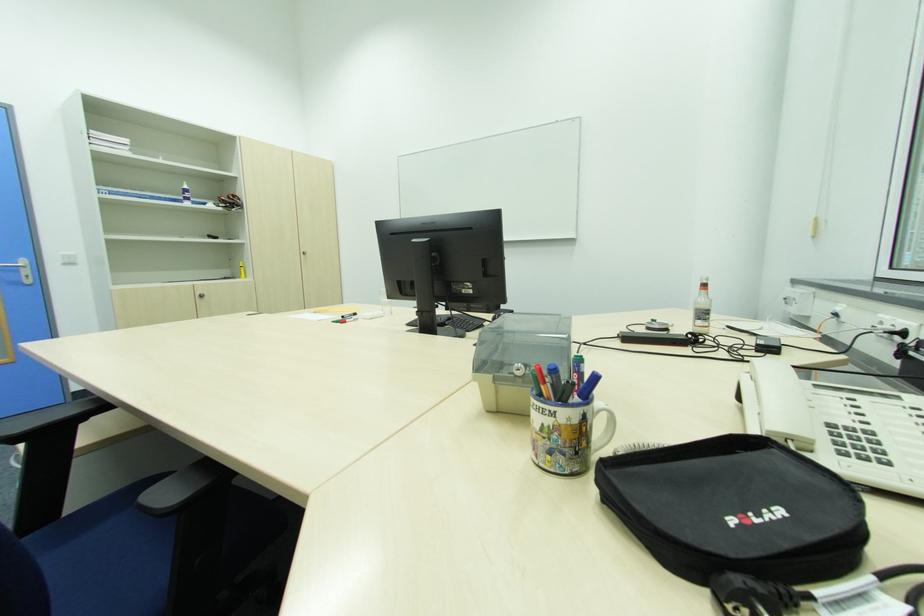
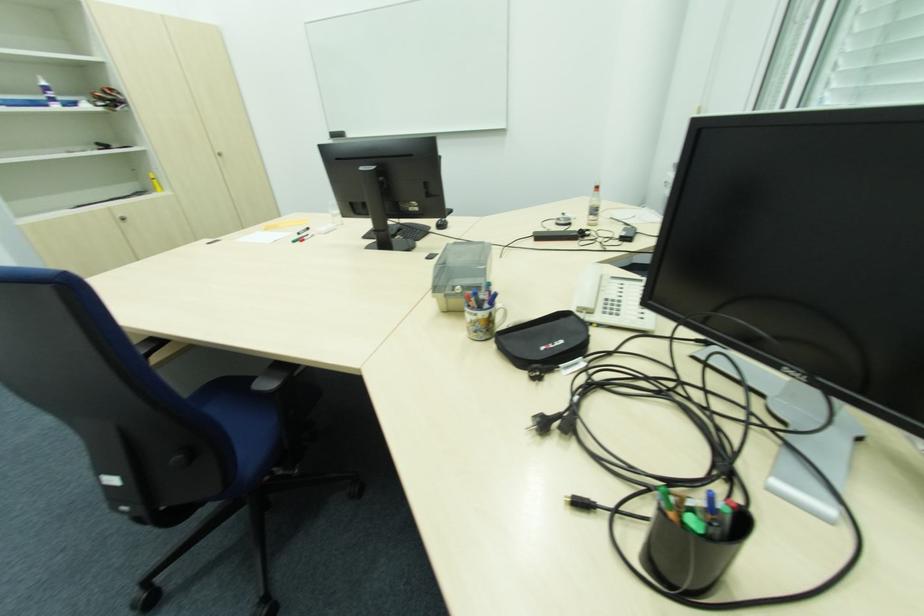
Where in the second image is the point corresponding to (x=783, y=513) from the first image?

(565, 342)